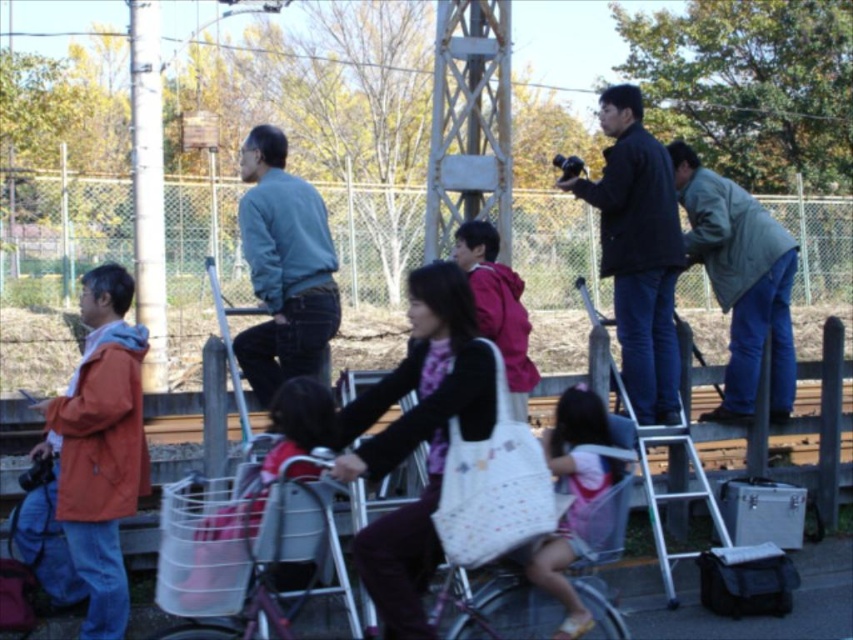
What is the color of the jacket worn by the person located at point (637, 252) in the image?

The point (637, 252) corresponds to the dark blue jacket at center, so the jacket is dark blue.

You are a photographer trying to capture a group photo of the dark blue jacket at center and the gray fabric jacket at right. Based on their heights, which jacket should you position closer to the camera to ensure both appear equally tall in the photo?

Since the dark blue jacket at center is much taller than the gray fabric jacket at right, you should position the gray fabric jacket at right closer to the camera to balance their apparent heights in the photo.

What is located at the coordinates point (741, 282) in the image?

At point (741, 282) lies gray fabric jacket at right.